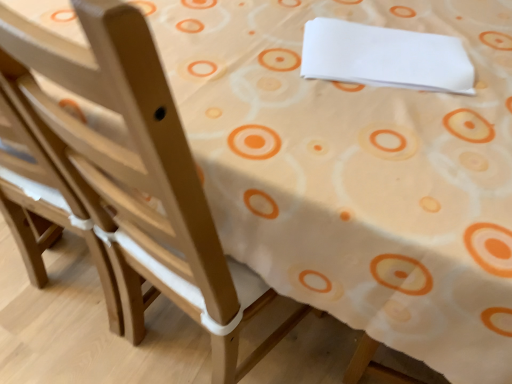
Question: Would you say white paper at upper right contains light wood chair at left?

Choices:
 (A) no
 (B) yes

Answer: (A)

Question: Does white paper at upper right have a larger size compared to light wood chair at left?

Choices:
 (A) no
 (B) yes

Answer: (A)

Question: Considering the relative positions of white paper at upper right and light wood chair at left in the image provided, is white paper at upper right to the left of light wood chair at left from the viewer's perspective?

Choices:
 (A) no
 (B) yes

Answer: (A)

Question: From a real-world perspective, is white paper at upper right positioned over light wood chair at left based on gravity?

Choices:
 (A) no
 (B) yes

Answer: (B)

Question: Considering the relative sizes of white paper at upper right and light wood chair at left in the image provided, is white paper at upper right wider than light wood chair at left?

Choices:
 (A) no
 (B) yes

Answer: (A)

Question: Can you confirm if white paper at upper right is taller than light wood chair at left?

Choices:
 (A) no
 (B) yes

Answer: (A)

Question: Is light wood chair at left not near white paper at upper right?

Choices:
 (A) no
 (B) yes

Answer: (A)

Question: From the image's perspective, is light wood chair at left over white paper at upper right?

Choices:
 (A) yes
 (B) no

Answer: (B)

Question: Is light wood chair at left facing towards white paper at upper right?

Choices:
 (A) no
 (B) yes

Answer: (A)

Question: Is light wood chair at left smaller than white paper at upper right?

Choices:
 (A) yes
 (B) no

Answer: (B)

Question: Is light wood chair at left oriented away from white paper at upper right?

Choices:
 (A) no
 (B) yes

Answer: (A)

Question: Is light wood chair at left touching white paper at upper right?

Choices:
 (A) no
 (B) yes

Answer: (A)

Question: Is light wood chair at left wider or thinner than white paper at upper right?

Choices:
 (A) wide
 (B) thin

Answer: (A)